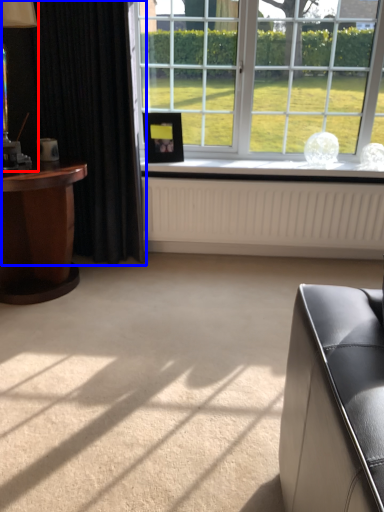
Question: Among these objects, which one is farthest to the camera, table lamp (highlighted by a red box) or curtain (highlighted by a blue box)?

Choices:
 (A) table lamp
 (B) curtain

Answer: (B)